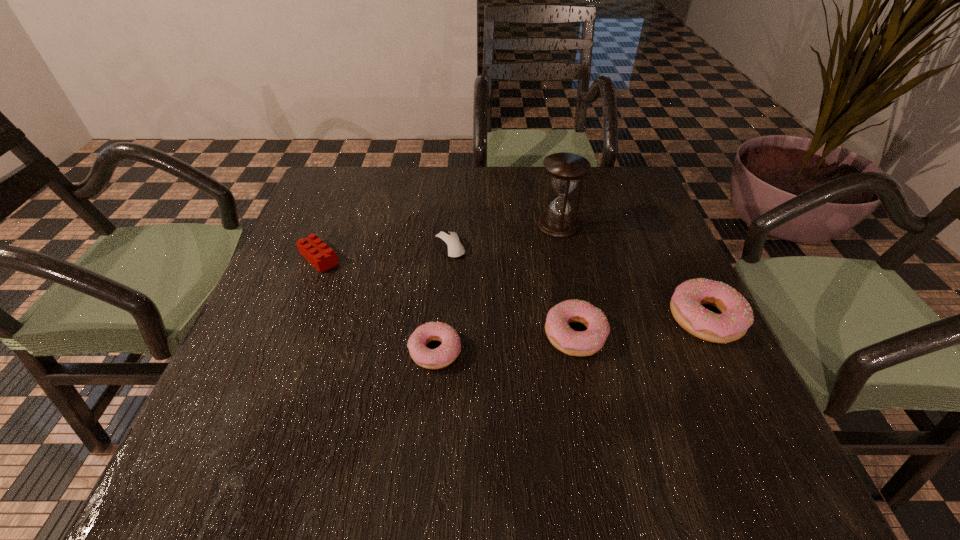
This screenshot has width=960, height=540. In the image, there is a desktop. In order to click on vacant space at the near left corner in this screenshot , I will do `click(247, 397)`.

The height and width of the screenshot is (540, 960). I want to click on vacant space at the far right corner of the desktop, so click(x=591, y=197).

In the image, there is a desktop. Where is `vacant space at the near right corner`? This screenshot has width=960, height=540. vacant space at the near right corner is located at coordinates (674, 396).

What are the coordinates of `vacant point located between the shortest doughnut and the hourglass` in the screenshot? It's located at (x=496, y=288).

The height and width of the screenshot is (540, 960). I want to click on empty space between the hourglass and the rightmost doughnut, so click(632, 272).

The height and width of the screenshot is (540, 960). I want to click on vacant area between the second tallest doughnut and the hourglass, so click(566, 279).

Find the location of `free space between the third tallest object and the rightmost object`. free space between the third tallest object and the rightmost object is located at coordinates (640, 326).

This screenshot has height=540, width=960. I want to click on blank region between the leftmost doughnut and the mouse, so click(443, 299).

At what (x,y) coordinates should I click in order to perform the action: click on vacant area that lies between the mouse and the second doughnut from right to left. Please return your answer as a coordinate pair (x, y). Looking at the image, I should click on (513, 291).

The height and width of the screenshot is (540, 960). Identify the location of vacant space that's between the Lego and the rightmost doughnut. (513, 288).